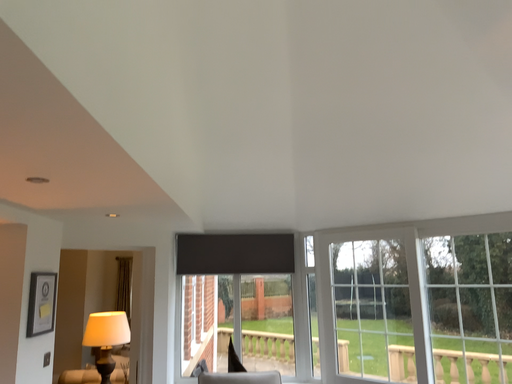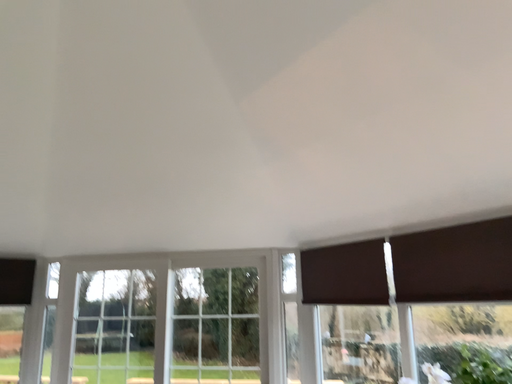
Question: Which way did the camera rotate in the video?

Choices:
 (A) rotated right
 (B) rotated left

Answer: (A)